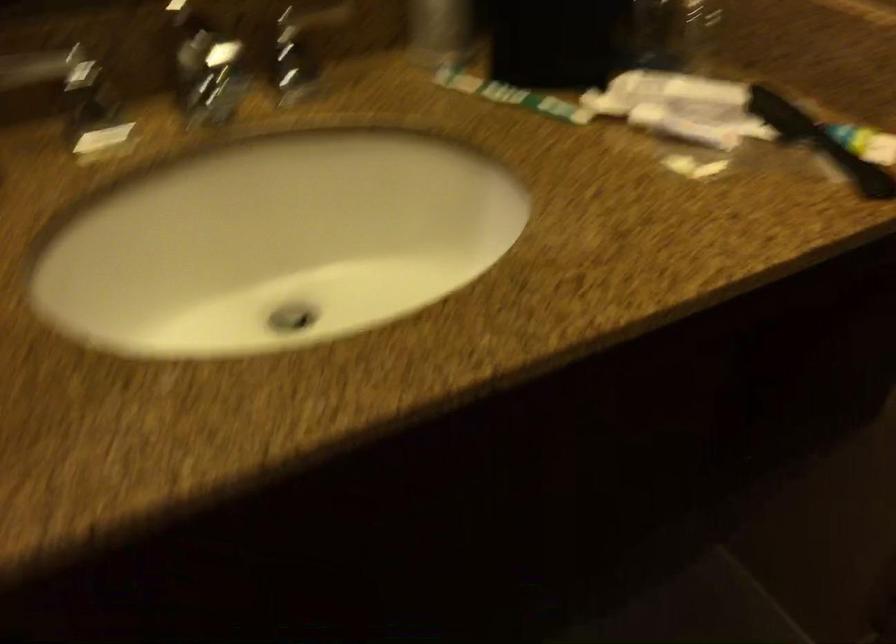
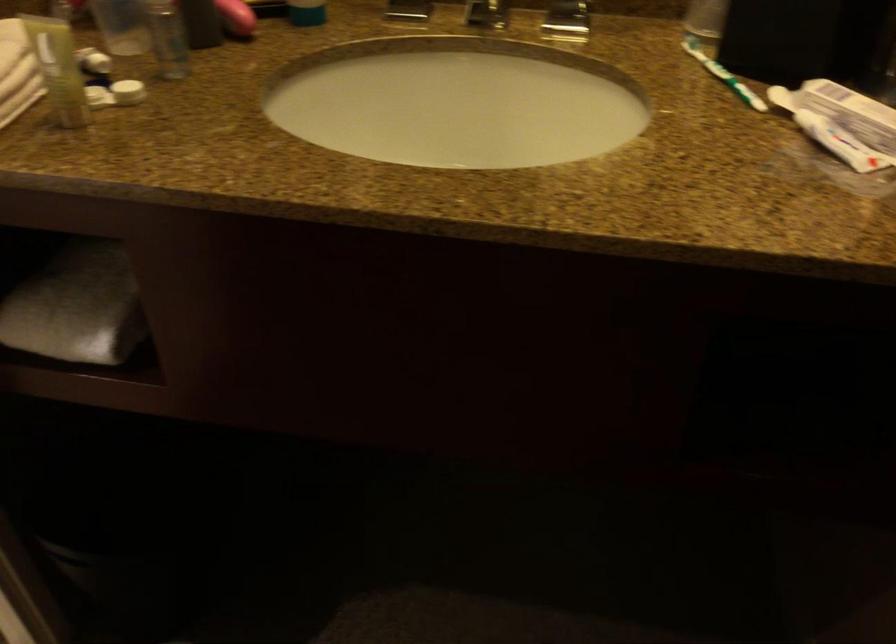
The point at (515, 90) is marked in the first image. Where is the corresponding point in the second image?

(722, 75)